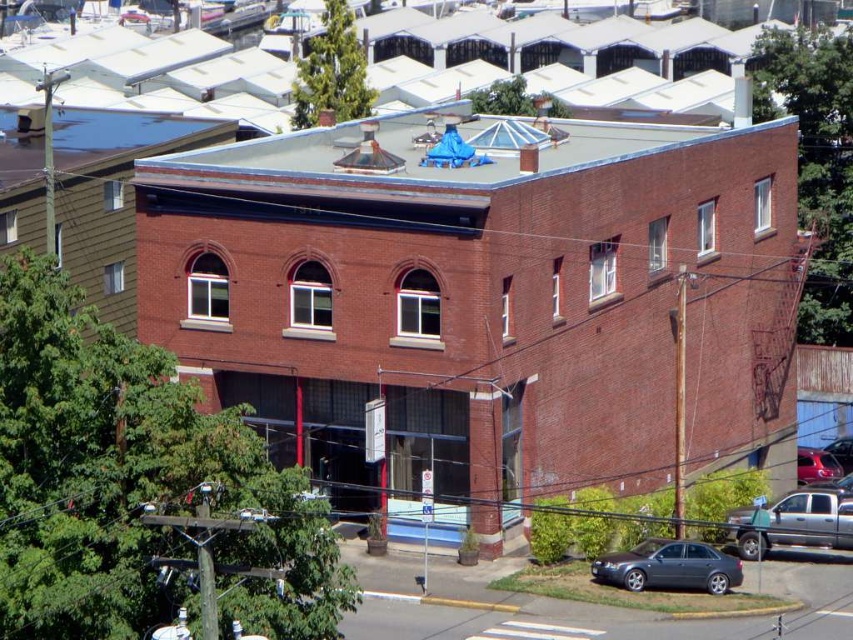
Question: Is metallic gray sedan at lower right in front of silver metallic truck at lower right?

Choices:
 (A) no
 (B) yes

Answer: (B)

Question: In this image, where is silver metallic truck at lower right located relative to shiny red car at lower right?

Choices:
 (A) right
 (B) left

Answer: (B)

Question: Which object appears farthest from the camera in this image?

Choices:
 (A) silver metallic truck at lower right
 (B) shiny red car at lower right
 (C) metallic gray sedan at lower right

Answer: (B)

Question: Does metallic gray sedan at lower right appear over silver metallic truck at lower right?

Choices:
 (A) no
 (B) yes

Answer: (A)

Question: Which point is farther to the camera?

Choices:
 (A) metallic gray sedan at lower right
 (B) shiny red car at lower right

Answer: (B)

Question: Which of the following is the farthest from the observer?

Choices:
 (A) shiny red car at lower right
 (B) silver metallic truck at lower right

Answer: (A)